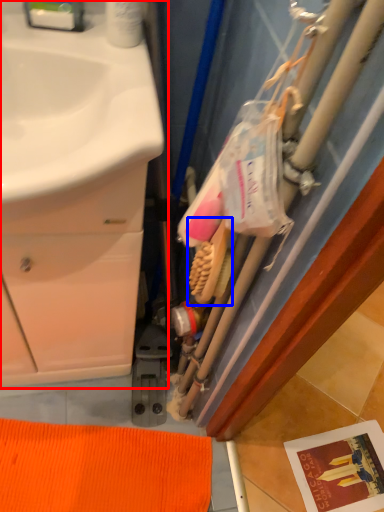
Question: Which object is further to the camera taking this photo, bathroom cabinet (highlighted by a red box) or brush (highlighted by a blue box)?

Choices:
 (A) bathroom cabinet
 (B) brush

Answer: (B)